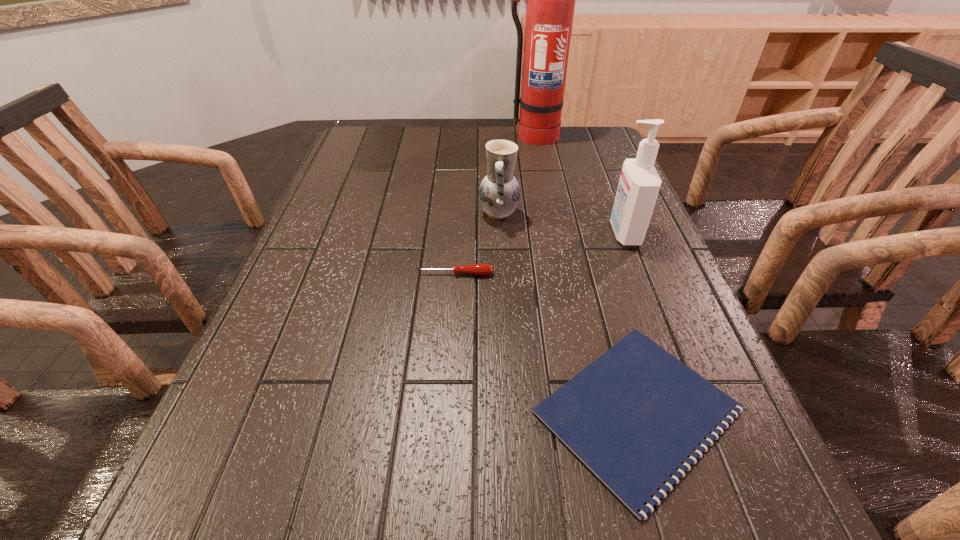
In order to click on free space between the pottery and the nearest object in this screenshot , I will do `click(567, 312)`.

The height and width of the screenshot is (540, 960). Find the location of `vacant region between the tallest object and the second tallest object`. vacant region between the tallest object and the second tallest object is located at coordinates (578, 185).

Identify the location of empty space that is in between the tallest object and the notepad. (585, 273).

The width and height of the screenshot is (960, 540). I want to click on free space between the fourth shortest object and the farthest object, so click(x=578, y=185).

You are a GUI agent. You are given a task and a screenshot of the screen. Output one action in this format:
    pyautogui.click(x=<x>, y=<y>)
    Task: Click on the free space between the third shortest object and the cleansing agent
    Image resolution: width=960 pixels, height=540 pixels.
    Given the screenshot: What is the action you would take?
    pyautogui.click(x=562, y=224)

Locate an element on the screen. The image size is (960, 540). free space between the notepad and the third tallest object is located at coordinates (567, 312).

This screenshot has width=960, height=540. In order to click on object that stands as the third closest to the cleansing agent in this screenshot , I will do `click(475, 269)`.

Locate which object is the second closest to the fire extinguisher. Please provide its 2D coordinates. Your answer should be formatted as a tuple, i.e. [(x, y)], where the tuple contains the x and y coordinates of a point satisfying the conditions above.

[(639, 184)]

This screenshot has height=540, width=960. I want to click on vacant area in the image that satisfies the following two spatial constraints: 1. on the label side of the farthest object; 2. on the right side of the shortest object, so click(x=586, y=411).

The height and width of the screenshot is (540, 960). I want to click on vacant point that satisfies the following two spatial constraints: 1. on the label side of the nearest object; 2. on the right side of the fire extinguisher, so click(x=586, y=411).